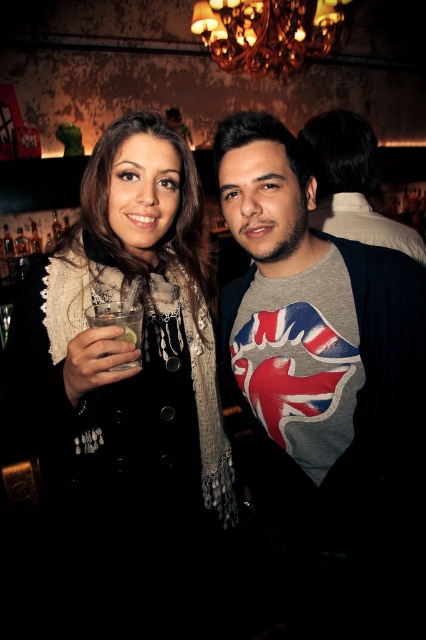
Which of these two, gray fabric shirt at center or clear glass at left, stands shorter?

Standing shorter between the two is clear glass at left.

Between gray fabric shirt at center and clear glass at left, which one is positioned higher?

Positioned higher is clear glass at left.

Identify the location of gray fabric shirt at center. (325, 392).

Image resolution: width=426 pixels, height=640 pixels. I want to click on gray fabric shirt at center, so pos(325,392).

Is matte black coat at center behind clear glass at left?

That is False.

Who is more distant from viewer, (212,422) or (106,323)?

Point (212,422)

In order to click on matte black coat at center in this screenshot , I will do `click(135, 376)`.

Is gray fabric shirt at center above matte black coat at center?

Yes.

Does gray fabric shirt at center have a lesser width compared to matte black coat at center?

Correct, gray fabric shirt at center's width is less than matte black coat at center's.

Image resolution: width=426 pixels, height=640 pixels. Find the location of `gray fabric shirt at center`. gray fabric shirt at center is located at coordinates (325, 392).

The width and height of the screenshot is (426, 640). Identify the location of gray fabric shirt at center. (325, 392).